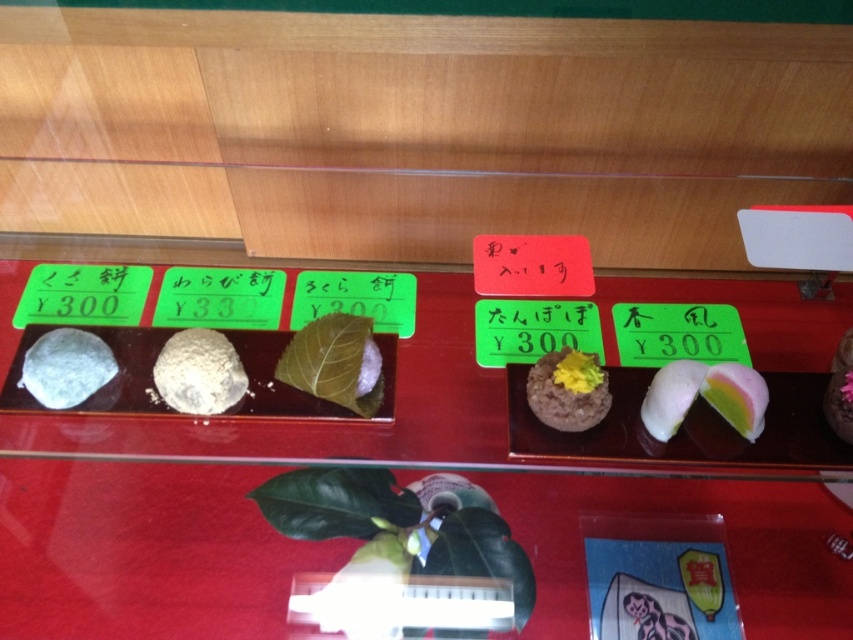
Which is more to the right, transparent glass tray at center or white matte rice ball at center?

From the viewer's perspective, transparent glass tray at center appears more on the right side.

Which is behind, point (608, 502) or point (202, 348)?

The point (608, 502) is more distant.

Is point (428, 445) farther from camera compared to point (161, 358)?

Yes, it is.

Identify the location of transparent glass tray at center. The height and width of the screenshot is (640, 853). (143, 552).

Does point (306, 381) come closer to viewer compared to point (732, 412)?

Yes, point (306, 381) is closer to viewer.

Which is behind, point (328, 390) or point (721, 410)?

Point (721, 410)

Find the location of a particular element. The width and height of the screenshot is (853, 640). green leafy wrap at center is located at coordinates (331, 362).

Which is below, green leafy wrap at center or white matte rice ball at center?

white matte rice ball at center is lower down.

Does point (318, 387) come behind point (195, 400)?

Yes, it is.

Who is more forward, (x=357, y=330) or (x=242, y=372)?

Point (x=357, y=330)

I want to click on green leafy wrap at center, so click(x=331, y=362).